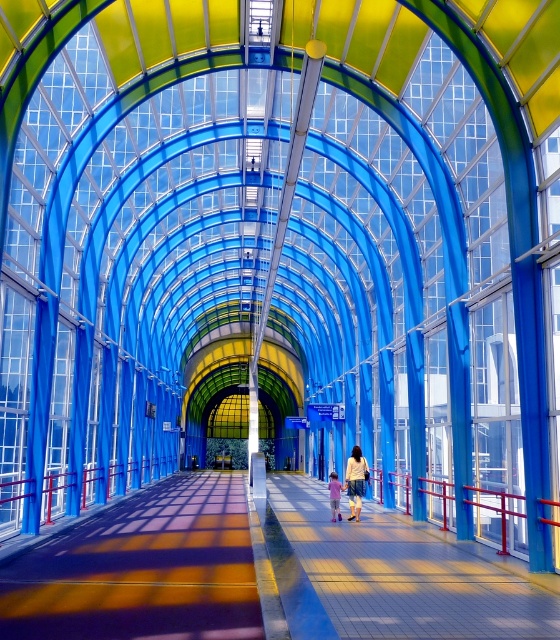
You are standing at the entrance of the walkway and see the denim shorts at center and the pastel pink fabric at center. Which object is positioned to the left?

The pastel pink fabric at center is positioned to the left of the denim shorts at center.